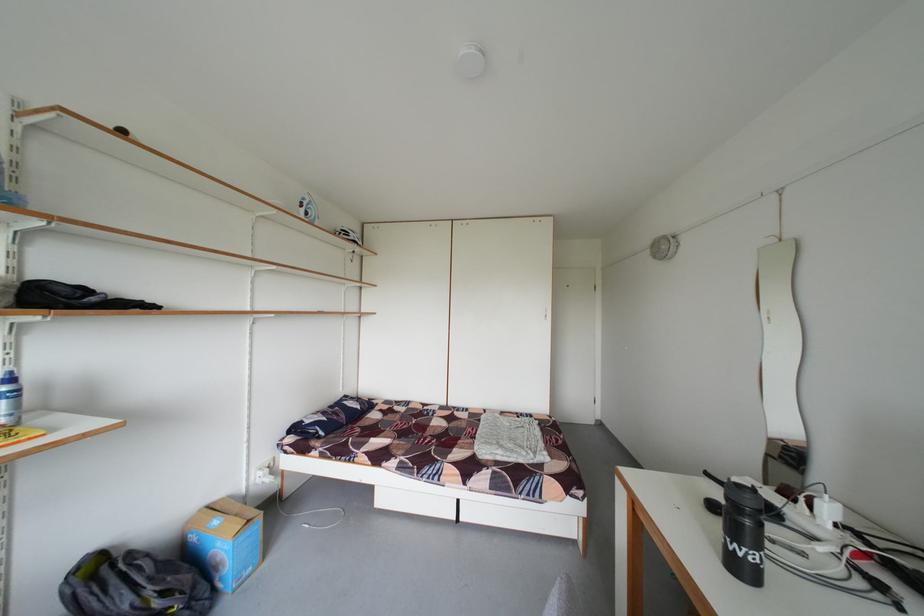
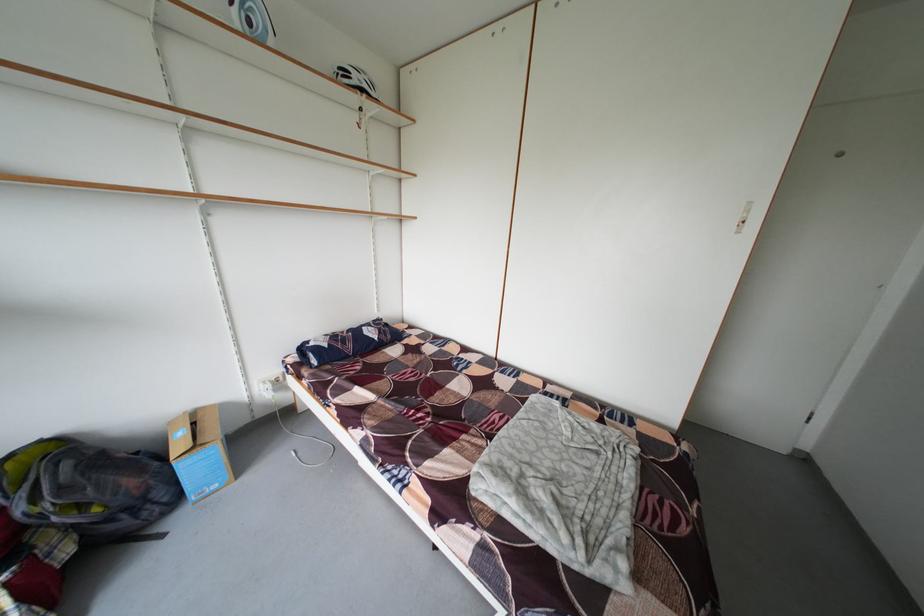
Where in the second image is the point corresponding to the point at 354,422 from the first image?

(360, 351)